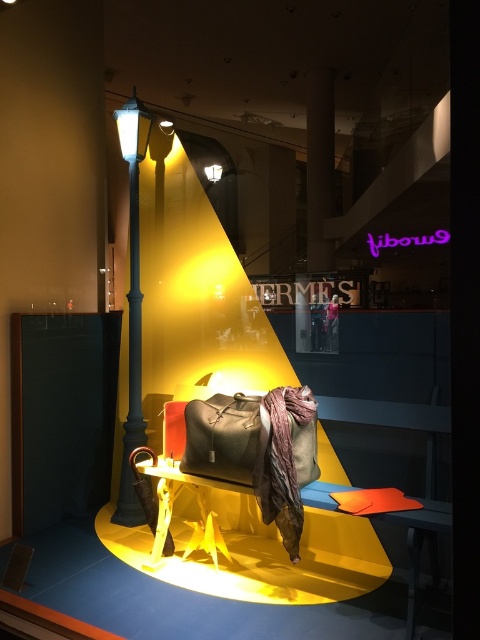
Who is taller, smooth concrete pillar at center or matte black lamp post at upper center?

With more height is smooth concrete pillar at center.

Which is more to the left, smooth concrete pillar at center or matte black lamp post at upper center?

Positioned to the left is matte black lamp post at upper center.

Which is behind, point (308, 248) or point (217, 172)?

Point (217, 172)

Where is `smooth concrete pillar at center`? Image resolution: width=480 pixels, height=640 pixels. smooth concrete pillar at center is located at coordinates (320, 164).

Does point (115, 515) lie behind point (316, 140)?

Yes, point (115, 515) is behind point (316, 140).

Which is in front, point (120, 132) or point (320, 108)?

Point (320, 108)

This screenshot has height=640, width=480. Describe the element at coordinates (132, 305) in the screenshot. I see `metallic blue lamp post at left` at that location.

Image resolution: width=480 pixels, height=640 pixels. Find the location of `metallic blue lamp post at left`. metallic blue lamp post at left is located at coordinates point(132,305).

Which is below, metallic blue lamp post at left or matte black lamp post at upper center?

metallic blue lamp post at left is below.

This screenshot has height=640, width=480. Identify the location of metallic blue lamp post at left. (x=132, y=305).